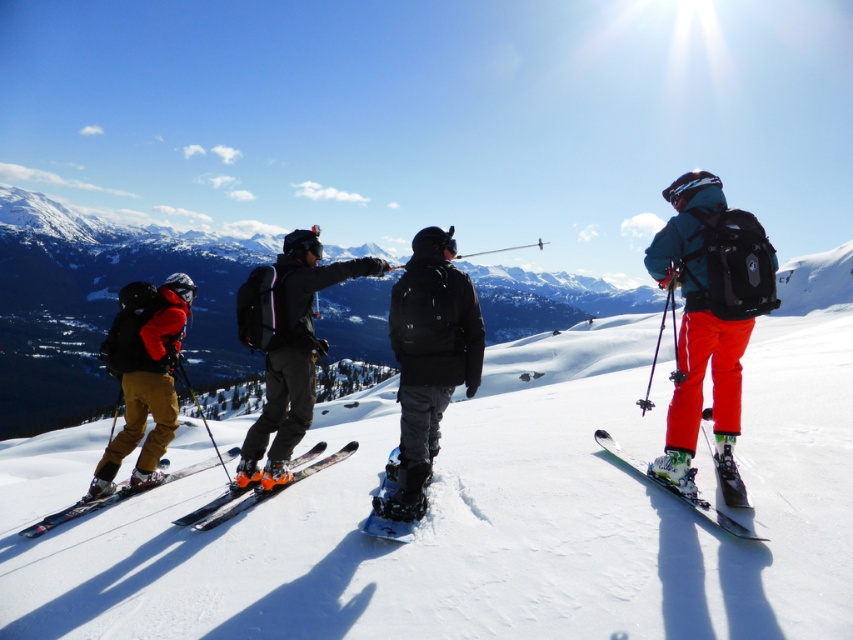
Between black matte snowboard at center and matte black backpack at left, which one has more height?

matte black backpack at left

You are a GUI agent. You are given a task and a screenshot of the screen. Output one action in this format:
    pyautogui.click(x=<x>, y=<y>)
    Task: Click on the black matte snowboard at center
    This screenshot has width=853, height=640.
    Given the screenshot: What is the action you would take?
    pyautogui.click(x=428, y=358)

Who is more distant from viewer, (433, 433) or (213, 504)?

Point (433, 433)

Which is below, black matte snowboard at center or orange metallic skis at center?

orange metallic skis at center is lower down.

Locate an element on the screen. The image size is (853, 640). black matte snowboard at center is located at coordinates (428, 358).

Who is more forward, (102, 618) or (704, 506)?

Point (102, 618)

Between point (756, 483) and point (596, 432), which one is positioned in front?

Point (756, 483)

The image size is (853, 640). What are the coordinates of `white snowboard at center` in the screenshot? It's located at (474, 515).